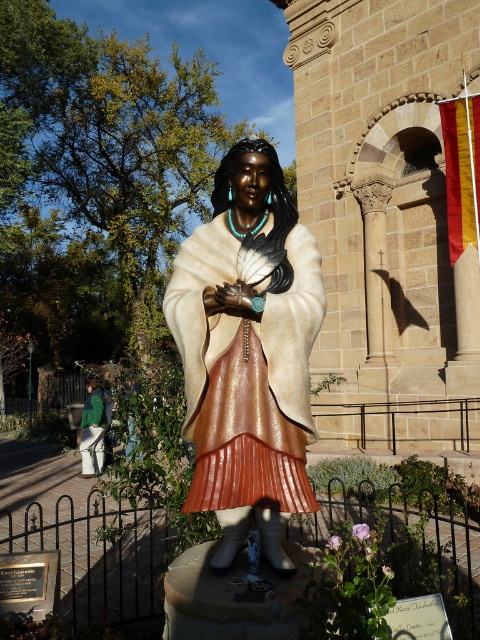
Does matte bronze statue at center have a lesser height compared to green fabric pants at lower left?

In fact, matte bronze statue at center may be taller than green fabric pants at lower left.

From the picture: Is matte bronze statue at center positioned in front of green fabric pants at lower left?

Yes, matte bronze statue at center is in front of green fabric pants at lower left.

Which is in front, point (230, 554) or point (94, 401)?

Positioned in front is point (230, 554).

The image size is (480, 640). In order to click on matte bronze statue at center in this screenshot , I will do `click(248, 353)`.